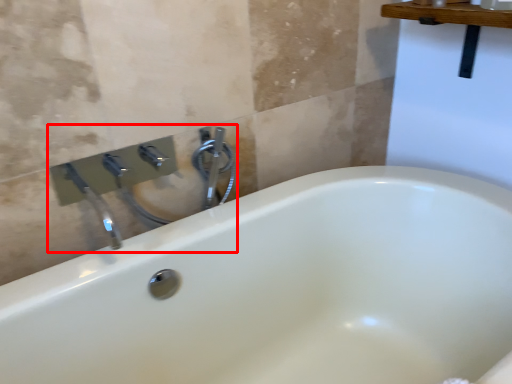
Question: From the image's perspective, what is the correct spatial positioning of sink (annotated by the red box) in reference to plumbing fixture?

Choices:
 (A) above
 (B) below

Answer: (B)